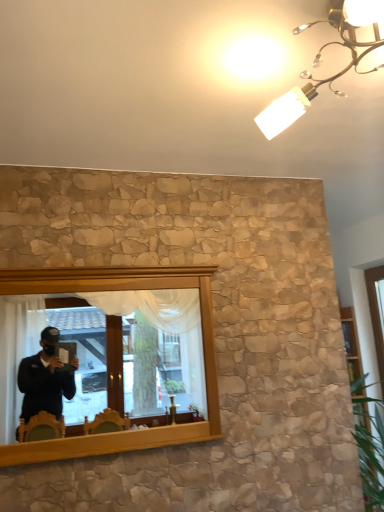
Question: From a real-world perspective, is white frosted glass light fixture at upper center on top of wooden mirror at center?

Choices:
 (A) yes
 (B) no

Answer: (A)

Question: Is white frosted glass light fixture at upper center oriented away from wooden mirror at center?

Choices:
 (A) no
 (B) yes

Answer: (A)

Question: Does white frosted glass light fixture at upper center have a lesser width compared to wooden mirror at center?

Choices:
 (A) yes
 (B) no

Answer: (B)

Question: Is white frosted glass light fixture at upper center to the left of wooden mirror at center from the viewer's perspective?

Choices:
 (A) yes
 (B) no

Answer: (B)

Question: Is white frosted glass light fixture at upper center taller than wooden mirror at center?

Choices:
 (A) yes
 (B) no

Answer: (B)

Question: Does white frosted glass light fixture at upper center have a smaller size compared to wooden mirror at center?

Choices:
 (A) yes
 (B) no

Answer: (B)

Question: Can you confirm if wooden mirror at center is thinner than white frosted glass light fixture at upper center?

Choices:
 (A) no
 (B) yes

Answer: (B)

Question: Does wooden mirror at center have a larger size compared to white frosted glass light fixture at upper center?

Choices:
 (A) no
 (B) yes

Answer: (A)

Question: Does wooden mirror at center have a lesser height compared to white frosted glass light fixture at upper center?

Choices:
 (A) no
 (B) yes

Answer: (A)

Question: Could white frosted glass light fixture at upper center be considered to be inside wooden mirror at center?

Choices:
 (A) yes
 (B) no

Answer: (B)

Question: Is wooden mirror at center not close to white frosted glass light fixture at upper center?

Choices:
 (A) yes
 (B) no

Answer: (A)

Question: Is wooden mirror at center wider than white frosted glass light fixture at upper center?

Choices:
 (A) yes
 (B) no

Answer: (B)

Question: From the image's perspective, relative to white frosted glass light fixture at upper center, is wooden mirror at center above or below?

Choices:
 (A) below
 (B) above

Answer: (A)